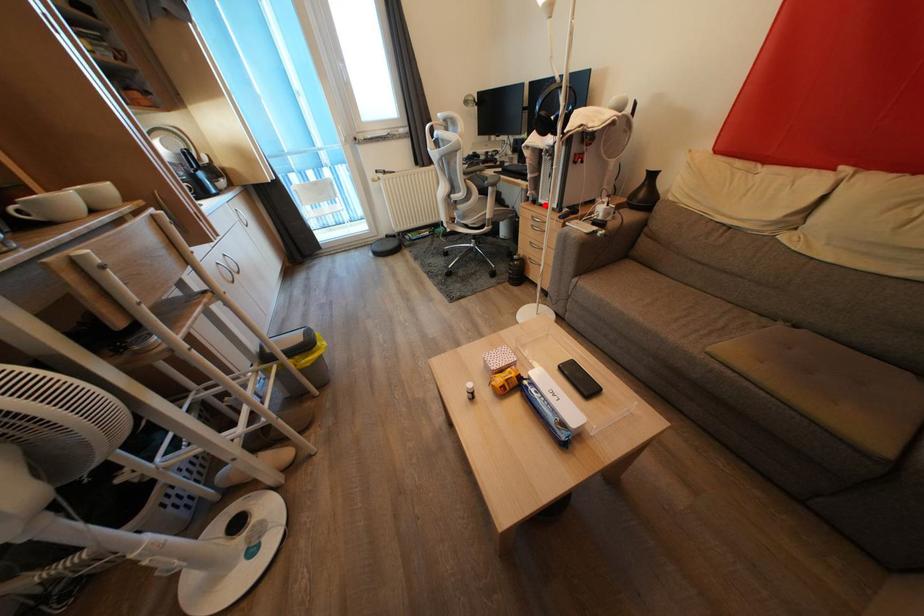
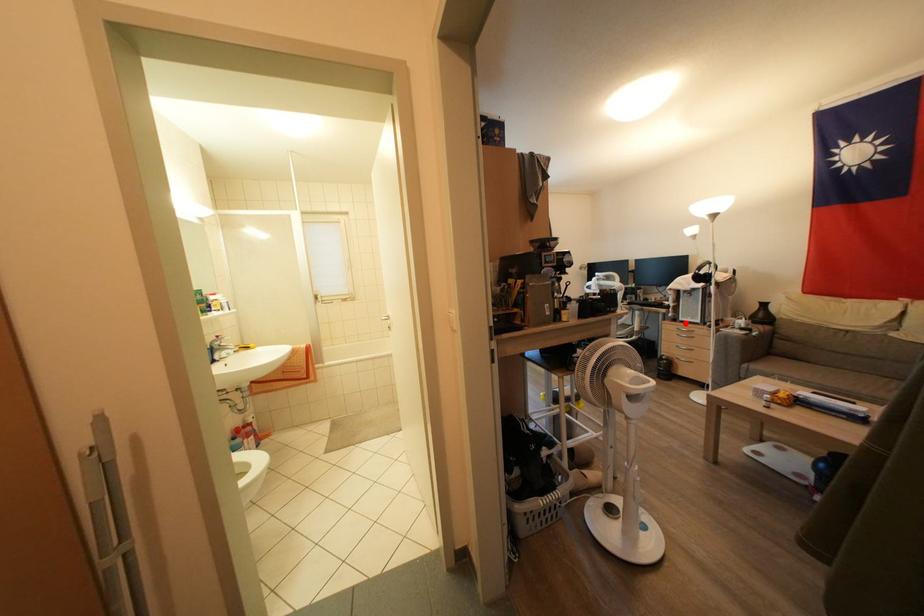
I am providing you with two images of the same scene from different viewpoints. A red point is marked on the first image and another point is marked on the second image. Does the point marked in image1 correspond to the same location as the one in image2?

Yes